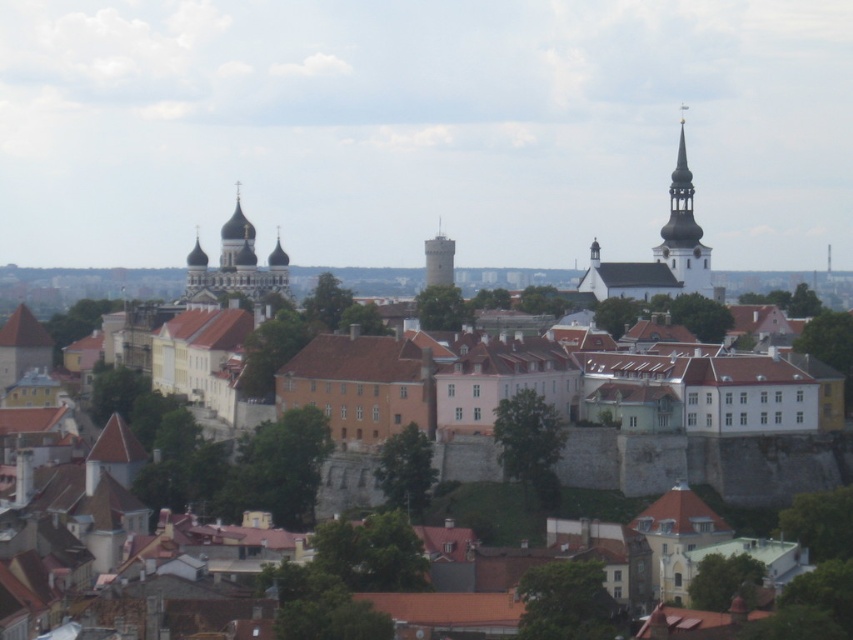
Based on the photo, you are an architect analyzing the cityscape. You notice the white smooth steeple at upper right and the smooth white tower at center. Which structure takes up more visual space in the image?

The smooth white tower at center occupies more visual space than the white smooth steeple at upper right.